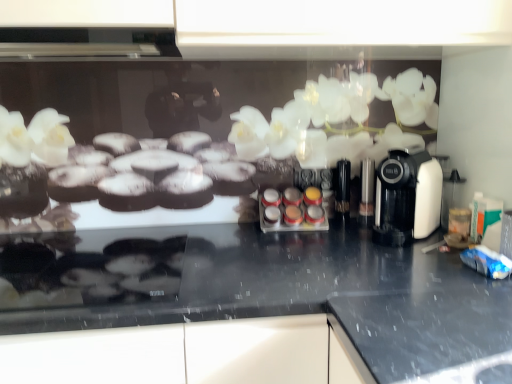
Question: Relative to translucent plastic spice rack at center, is black granite countertop at center in front or behind?

Choices:
 (A) front
 (B) behind

Answer: (A)

Question: From the image's perspective, is black granite countertop at center positioned above or below translucent plastic spice rack at center?

Choices:
 (A) above
 (B) below

Answer: (B)

Question: Which object is the farthest from the translucent plastic spice rack at center?

Choices:
 (A) white plastic coffee machine at right
 (B) black granite countertop at center

Answer: (B)

Question: Which is nearer to the translucent plastic spice rack at center?

Choices:
 (A) white plastic coffee machine at right
 (B) black granite countertop at center

Answer: (A)